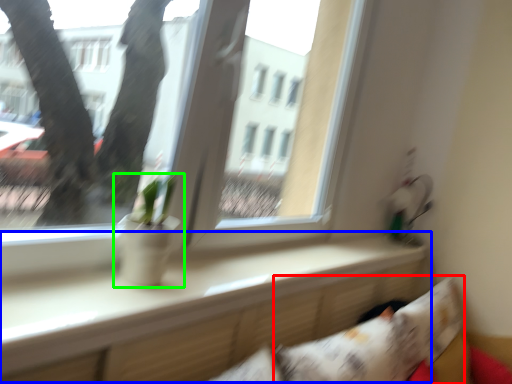
Question: Considering the real-world distances, which object is farthest from pillow (highlighted by a red box)? window sill (highlighted by a blue box) or houseplant (highlighted by a green box)?

Choices:
 (A) window sill
 (B) houseplant

Answer: (B)